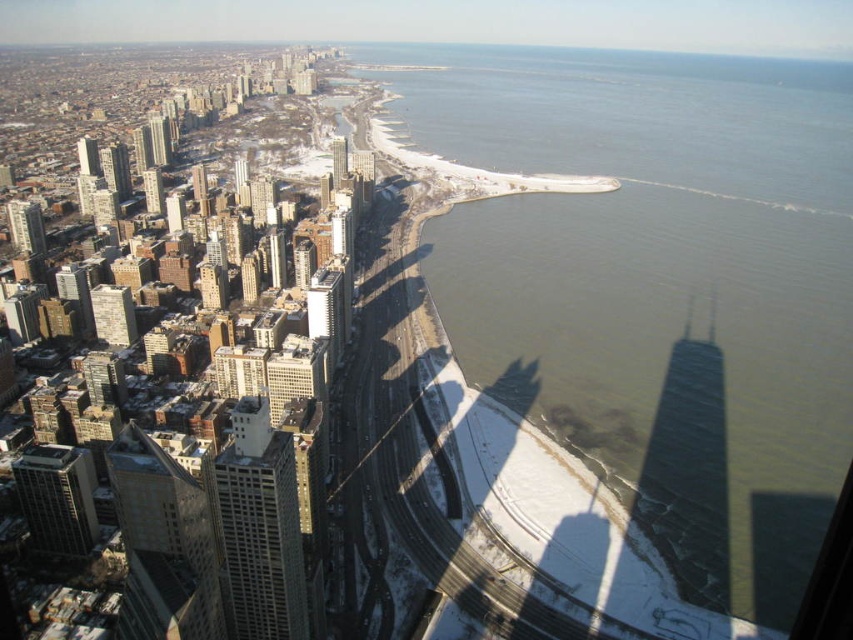
Which is in front, point (612, 154) or point (306, 168)?

Point (306, 168) is more forward.

Who is more distant from viewer, [469,109] or [277,113]?

The point [277,113] is more distant.

The width and height of the screenshot is (853, 640). Identify the location of greenish water at center right. (659, 288).

Who is shorter, gray concrete building at lower left or matte glass skyscraper at center?

matte glass skyscraper at center is shorter.

Describe the element at coordinates (57, 497) in the screenshot. I see `gray concrete building at lower left` at that location.

Between point (78, 518) and point (332, 154), which one is positioned behind?

The point (78, 518) is more distant.

Where is `gray concrete building at lower left`? Image resolution: width=853 pixels, height=640 pixels. gray concrete building at lower left is located at coordinates (57, 497).

Does greenish water at center right appear on the left side of matte glass skyscraper at center?

No, greenish water at center right is not to the left of matte glass skyscraper at center.

Does greenish water at center right have a larger size compared to matte glass skyscraper at center?

Yes, greenish water at center right is bigger than matte glass skyscraper at center.

Which is in front, point (685, 56) or point (339, 170)?

Point (339, 170) is more forward.

Locate an element on the screen. greenish water at center right is located at coordinates (659, 288).